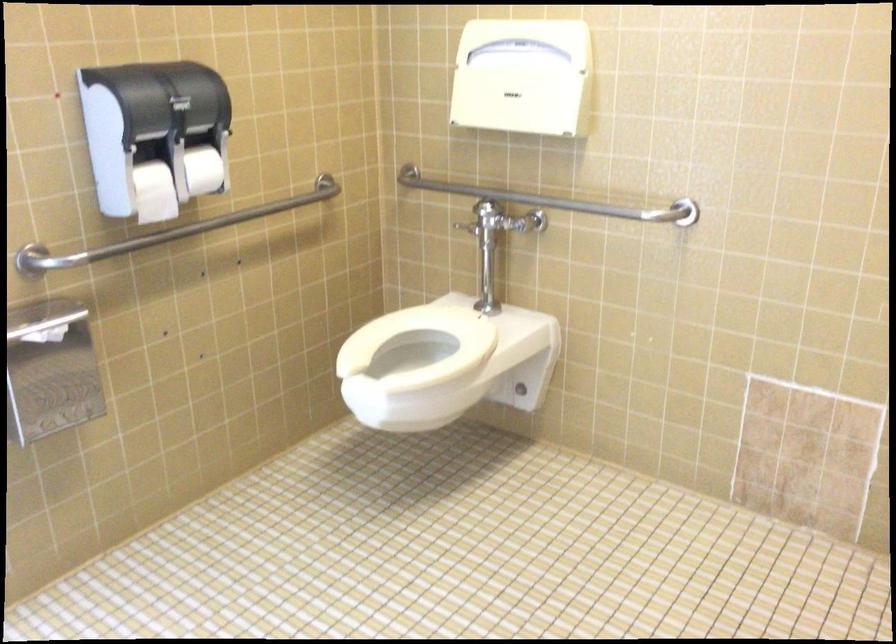
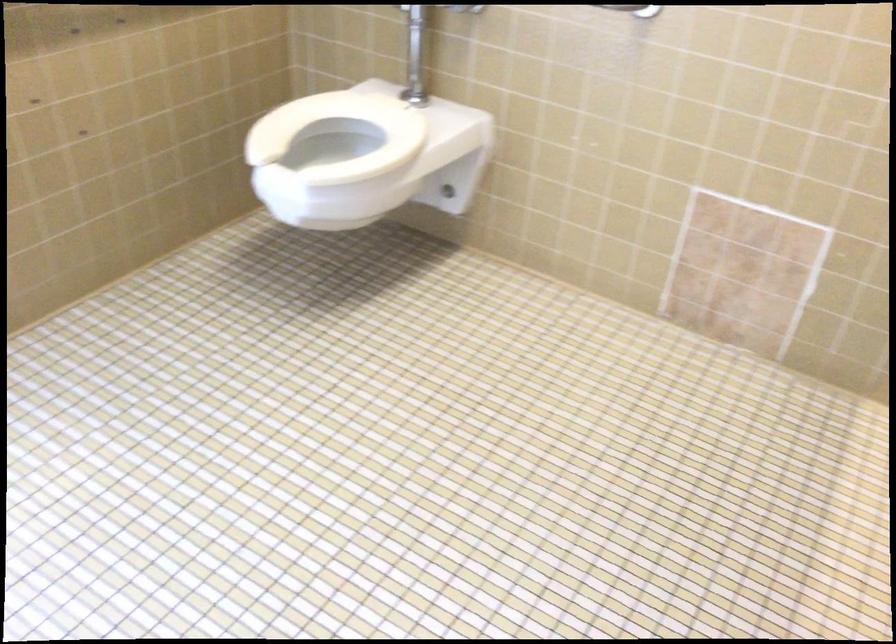
Question: The first image is from the beginning of the video and the second image is from the end. How did the camera likely rotate when shooting the video?

Choices:
 (A) Left
 (B) Right
 (C) Up
 (D) Down

Answer: (D)